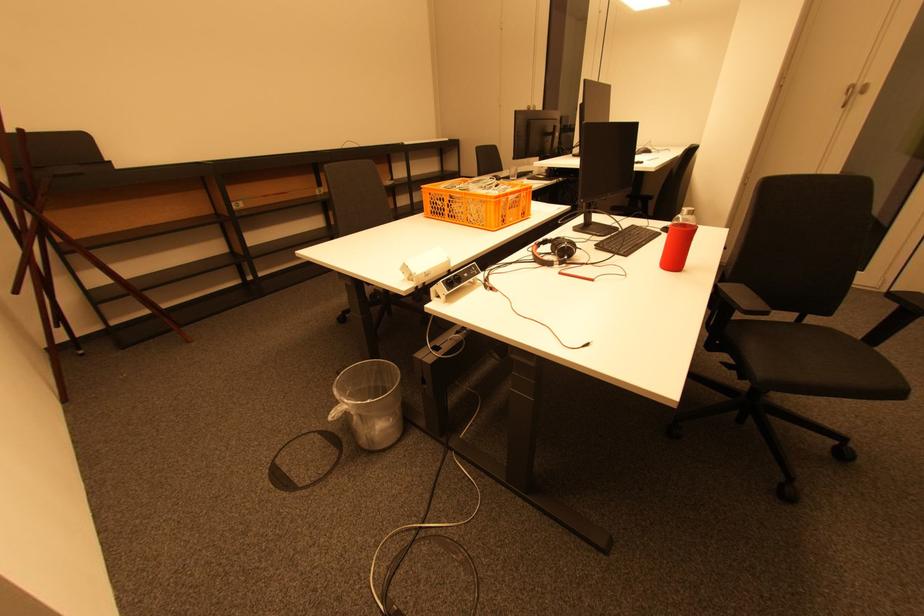
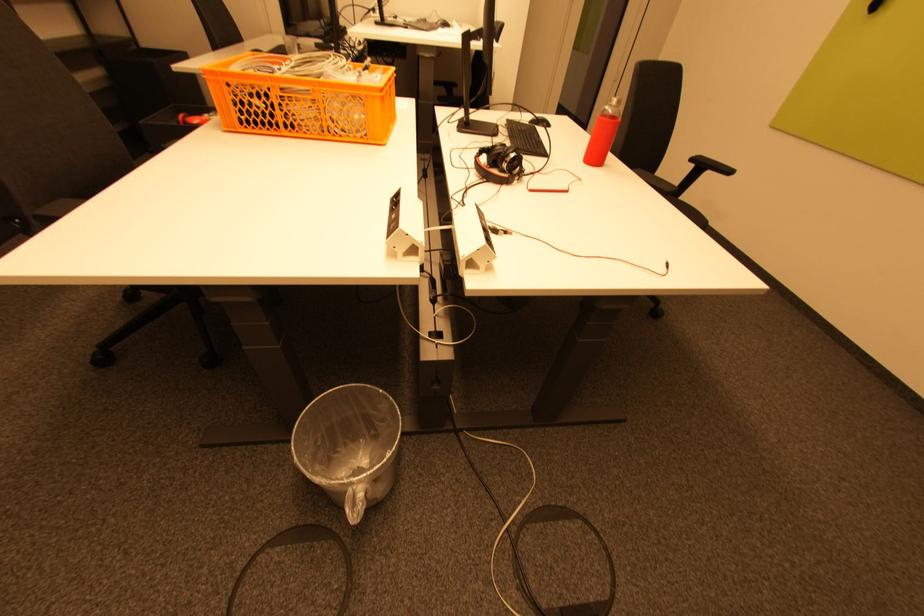
Based on the continuous images, in which direction is the camera rotating?

The camera rotated toward right-down.